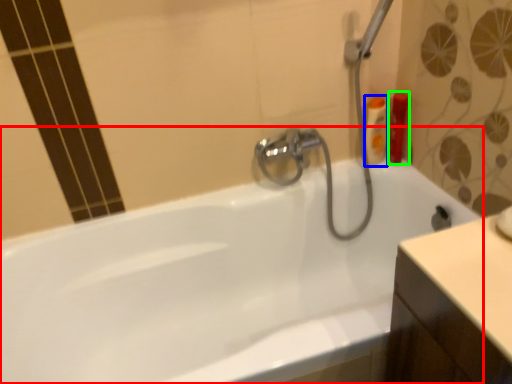
Question: Estimate the real-world distances between objects in this image. Which object is farther from bathtub (highlighted by a red box), toiletry (highlighted by a blue box) or toiletry (highlighted by a green box)?

Choices:
 (A) toiletry
 (B) toiletry

Answer: (B)